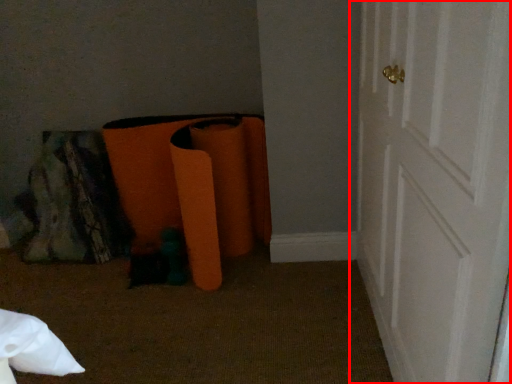
Question: From the image's perspective, considering the relative positions of door (annotated by the red box) and bean bag chair in the image provided, where is door (annotated by the red box) located with respect to the staircase?

Choices:
 (A) below
 (B) above

Answer: (A)